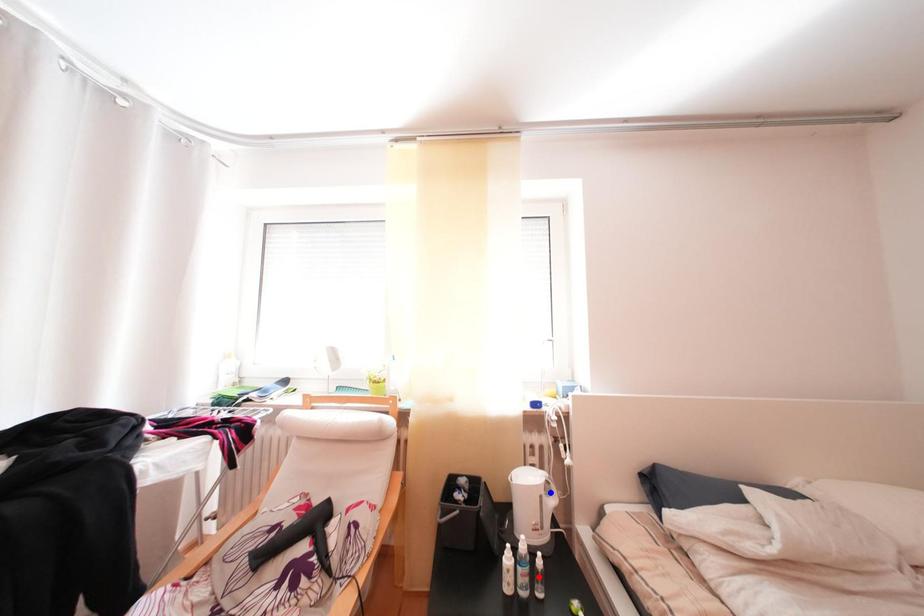
Question: Which of the two points in the image is closer to the camera?

Choices:
 (A) Blue point is closer.
 (B) Red point is closer.

Answer: (B)